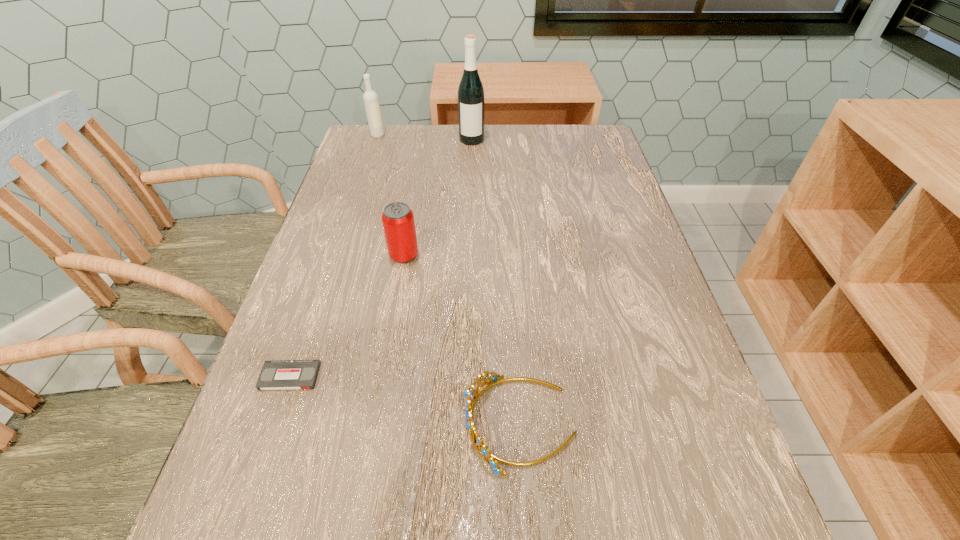
The width and height of the screenshot is (960, 540). In order to click on vacant space at the right edge of the desktop in this screenshot , I will do `click(588, 212)`.

The height and width of the screenshot is (540, 960). In order to click on vacant area at the far left corner in this screenshot , I will do `click(371, 152)`.

Locate an element on the screen. blank area at the far right corner is located at coordinates (583, 134).

Find the location of a particular element. vacant space that is in between the tallest object and the third shortest object is located at coordinates (438, 198).

Identify the location of vacant space that is in between the wine bottle and the shortest object. (381, 258).

In order to click on free space between the shortest object and the third shortest object in this screenshot , I will do `click(347, 316)`.

I want to click on free space between the tiara and the fourth shortest object, so click(449, 279).

Locate an element on the screen. This screenshot has width=960, height=540. free spot between the vodka and the wine bottle is located at coordinates (424, 138).

Identify the location of empty space between the fourth shortest object and the wine bottle. tap(424, 138).

Where is `vacant space that's between the second tallest object and the wine bottle`? This screenshot has width=960, height=540. vacant space that's between the second tallest object and the wine bottle is located at coordinates click(424, 138).